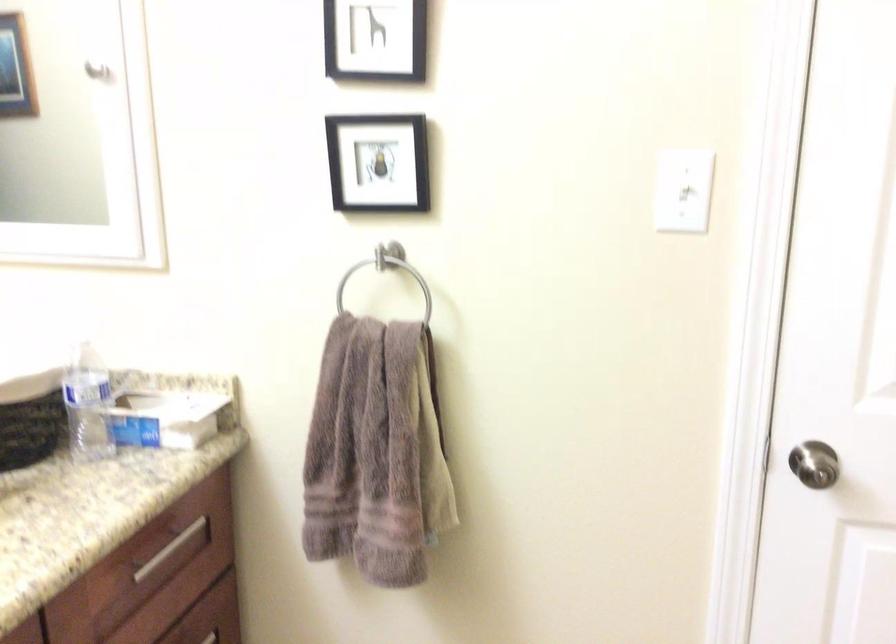
Where would you flick the light switch toggle? Please return your answer as a coordinate pair (x, y).

(683, 190)